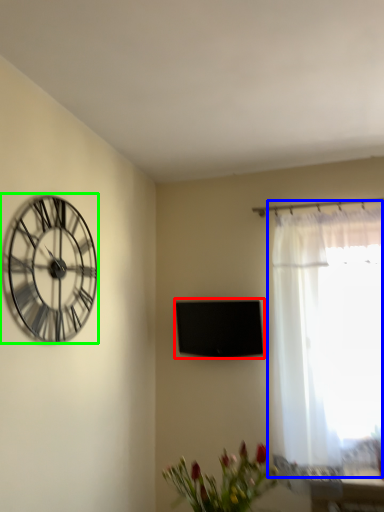
Question: Which object is positioned closest to window screen (highlighted by a red box)? Select from window (highlighted by a blue box) and wall clock (highlighted by a green box).

Choices:
 (A) window
 (B) wall clock

Answer: (A)